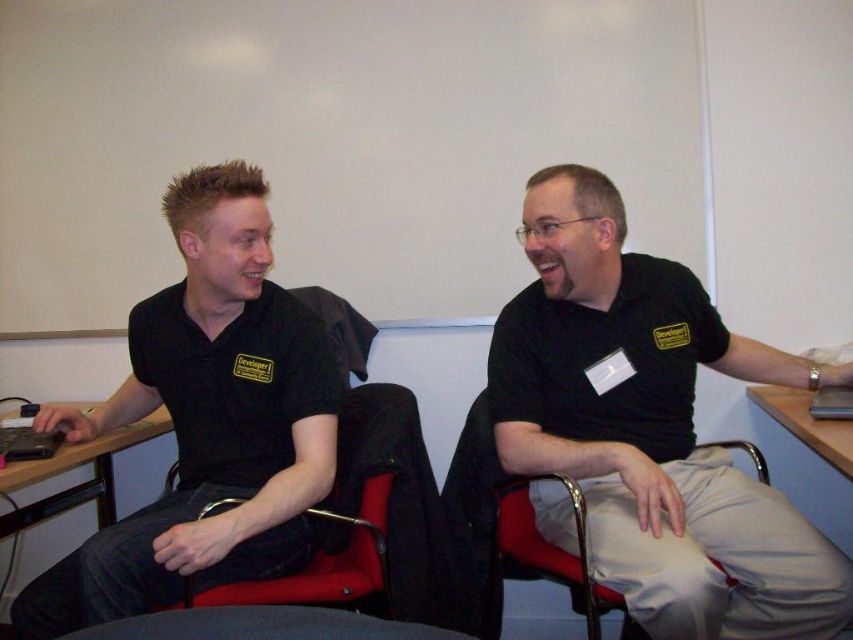
Question: Does red fabric chair at center appear on the left side of wooden desk at left?

Choices:
 (A) yes
 (B) no

Answer: (B)

Question: Is black matte shirt at left above red fabric swivel chair at left?

Choices:
 (A) no
 (B) yes

Answer: (B)

Question: Based on their relative distances, which object is nearer to the red fabric chair at center?

Choices:
 (A) gray fabric chair at lower center
 (B) black matte shirt at center
 (C) red fabric swivel chair at left

Answer: (B)

Question: Which point is closer to the camera taking this photo?

Choices:
 (A) (396, 573)
 (B) (93, 419)
 (C) (793, 384)

Answer: (A)

Question: Based on their relative distances, which object is nearer to the wooden desk at right?

Choices:
 (A) red fabric chair at center
 (B) wooden desk at left

Answer: (A)

Question: Is red fabric chair at center to the left of wooden desk at left from the viewer's perspective?

Choices:
 (A) no
 (B) yes

Answer: (A)